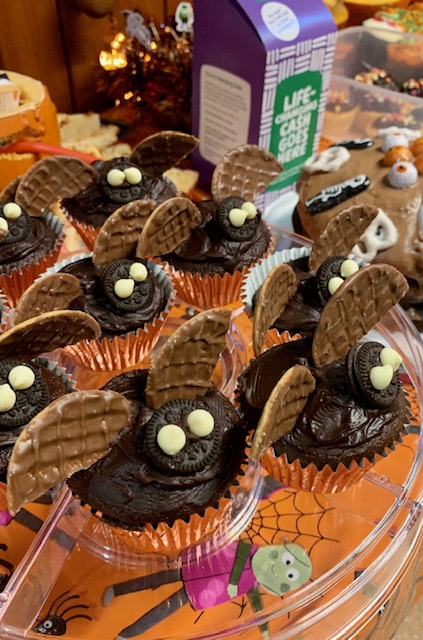
I want to click on paper container, so click(x=249, y=72).